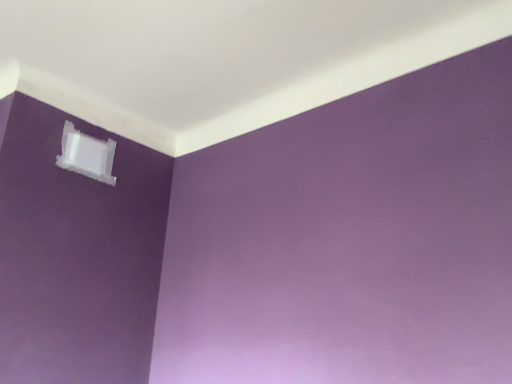
The width and height of the screenshot is (512, 384). I want to click on white plastic window at upper left, so click(86, 155).

Measure the distance between white plastic window at upper left and camera.

A distance of 6.68 feet exists between white plastic window at upper left and camera.

This screenshot has height=384, width=512. What do you see at coordinates (86, 155) in the screenshot?
I see `white plastic window at upper left` at bounding box center [86, 155].

At what (x,y) coordinates should I click in order to perform the action: click on white plastic window at upper left. Please return your answer as a coordinate pair (x, y). This screenshot has height=384, width=512. Looking at the image, I should click on (86, 155).